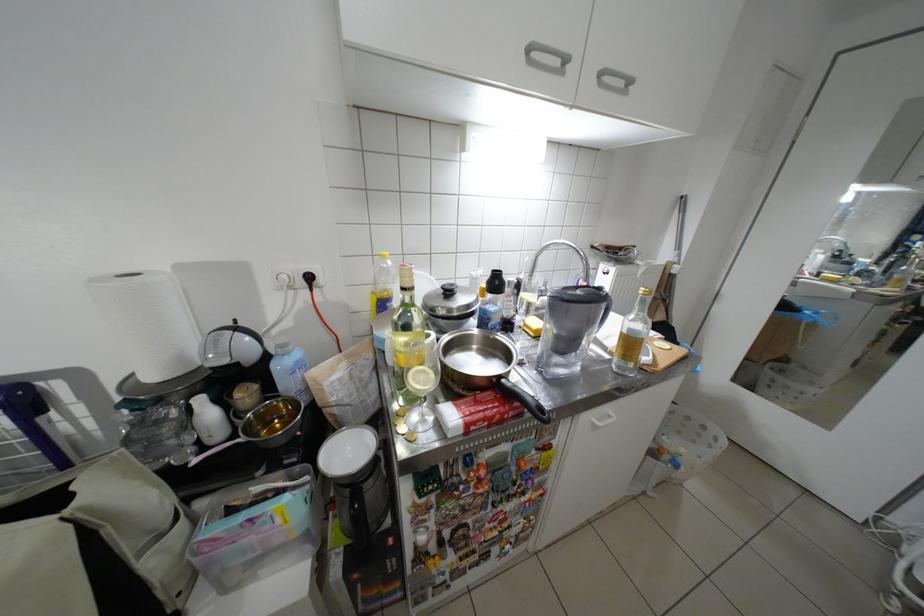
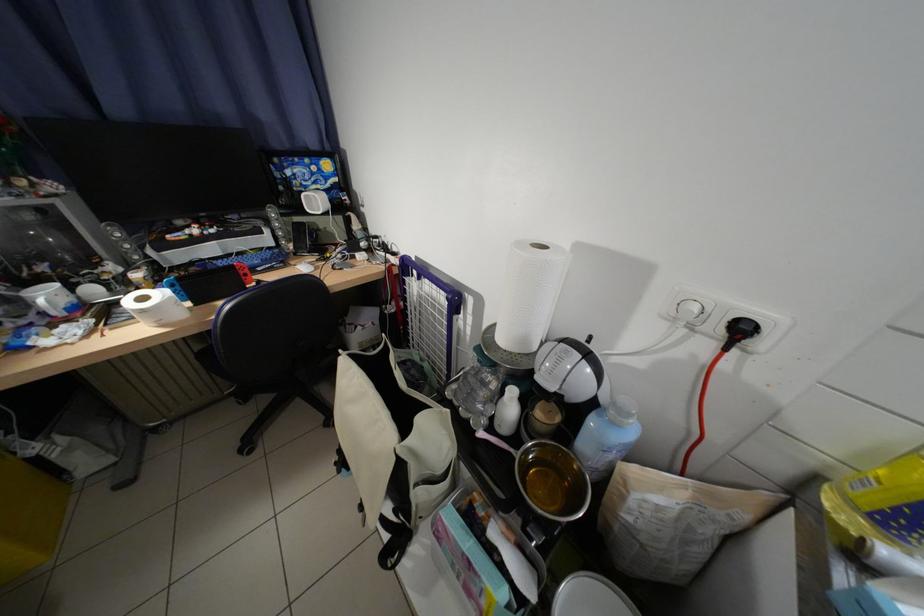
Find the pixel in the second image that matches [315,284] in the first image.

(734, 333)